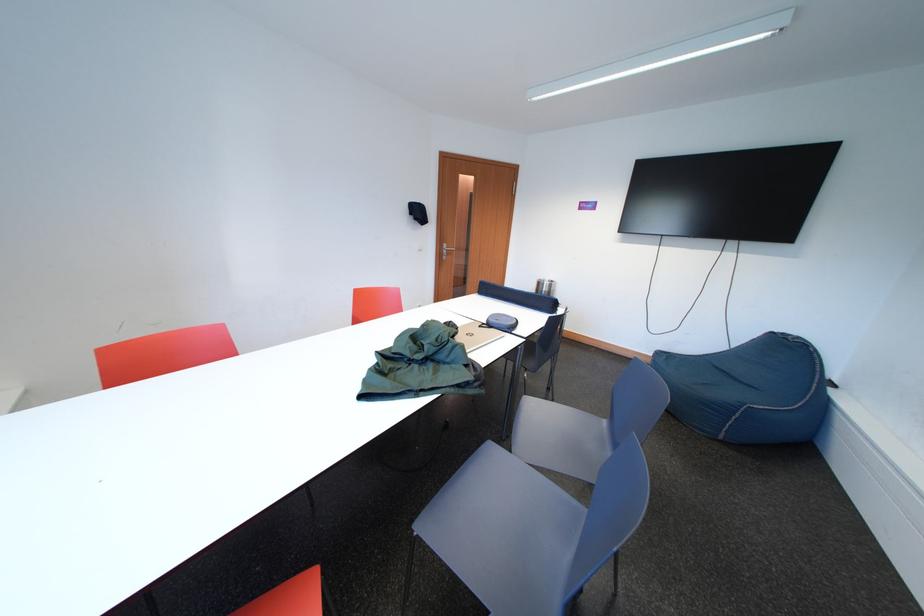
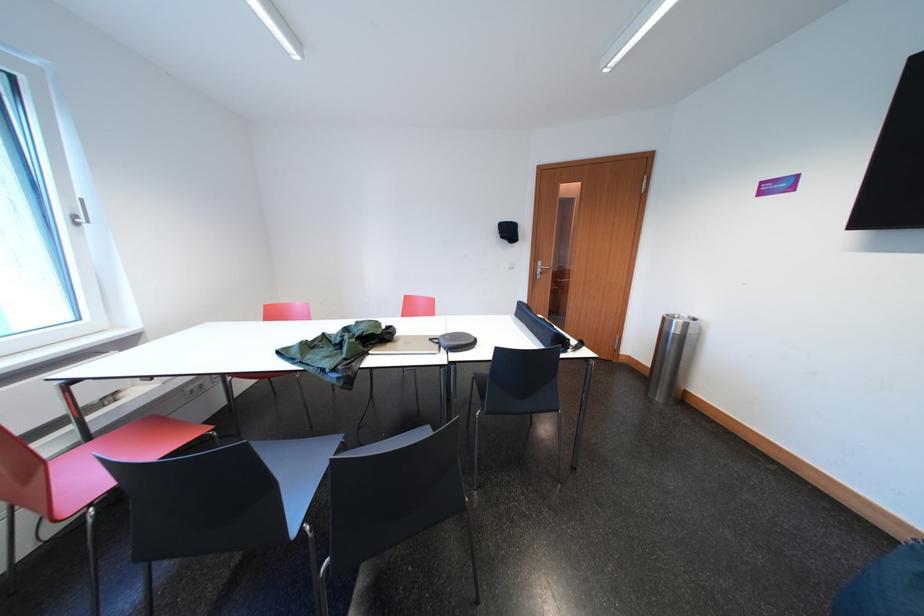
Find the pixel in the second image that matches (549,288) in the first image.

(675, 325)